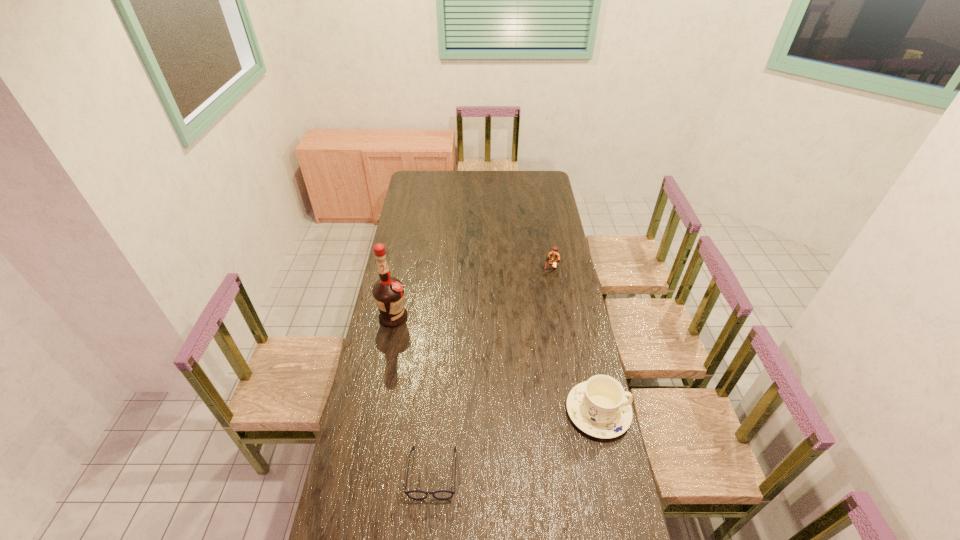
At what (x,y) coordinates should I click in order to perform the action: click on blank region between the leftmost object and the farthest object. Please return your answer as a coordinate pair (x, y). Image resolution: width=960 pixels, height=540 pixels. Looking at the image, I should click on (471, 293).

Locate an element on the screen. The width and height of the screenshot is (960, 540). object that is the closest to the second farthest object is located at coordinates (414, 494).

You are a GUI agent. You are given a task and a screenshot of the screen. Output one action in this format:
    pyautogui.click(x=<x>, y=<y>)
    Task: Click on the object that is the third closest one to the Lego
    This screenshot has width=960, height=540.
    Given the screenshot: What is the action you would take?
    pyautogui.click(x=414, y=494)

Find the location of a particular element. Image resolution: width=960 pixels, height=540 pixels. blank space that satisfies the following two spatial constraints: 1. on the front side of the Lego; 2. on the handle side of the third farthest object is located at coordinates [575, 411].